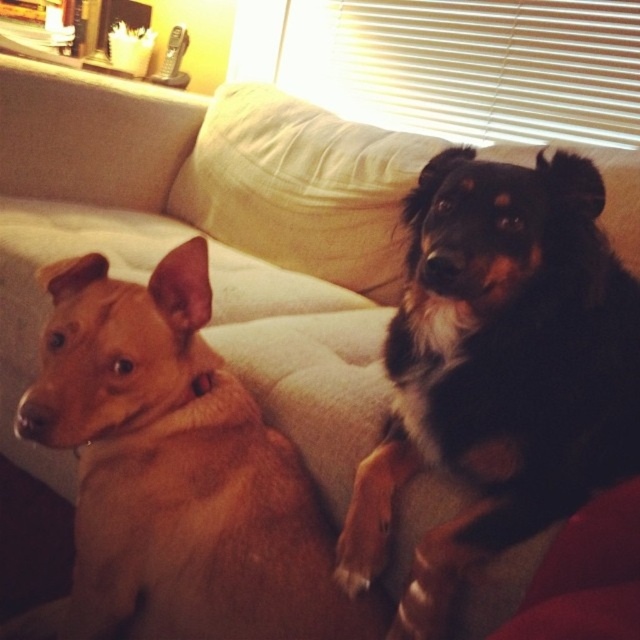
Question: Is black fur dog at center wider than beige fabric pillow at upper center?

Choices:
 (A) no
 (B) yes

Answer: (A)

Question: Observing the image, what is the correct spatial positioning of black fur dog at center in reference to beige fabric pillow at upper center?

Choices:
 (A) left
 (B) right

Answer: (B)

Question: In this image, where is black fur dog at center located relative to beige fabric pillow at upper center?

Choices:
 (A) left
 (B) right

Answer: (B)

Question: Which point is farther from the camera taking this photo?

Choices:
 (A) (598, 321)
 (B) (234, 209)

Answer: (B)

Question: Which point is closer to the camera?

Choices:
 (A) (262, 97)
 (B) (522, 529)

Answer: (B)